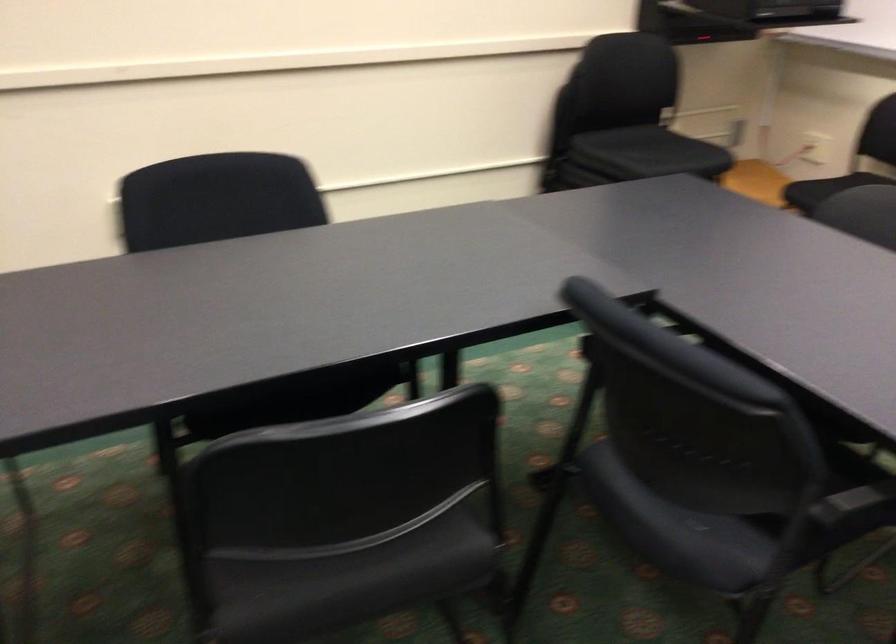
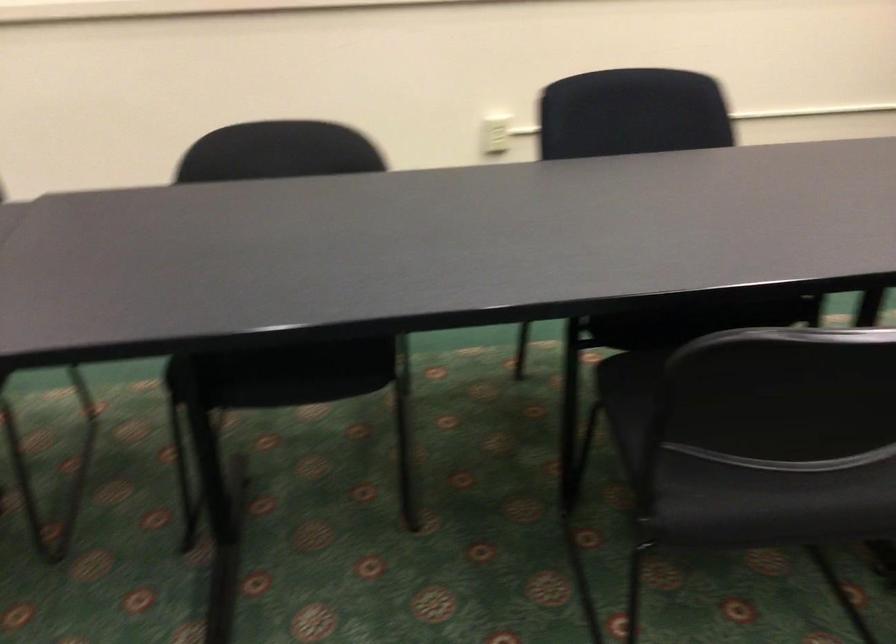
Question: The images are taken continuously from a first-person perspective. In which direction are you moving?

Choices:
 (A) Left
 (B) Right
 (C) Forward
 (D) Backward

Answer: (A)